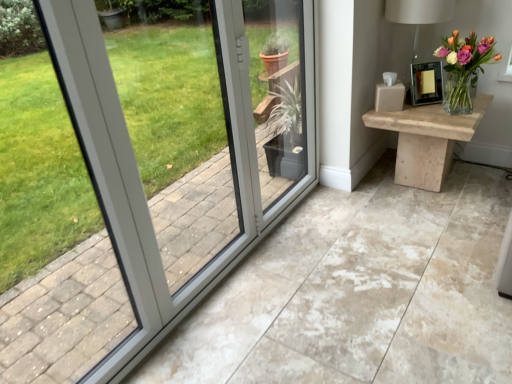
Question: Is natural wood table at right at the left side of clear glass vase at upper right?

Choices:
 (A) no
 (B) yes

Answer: (B)

Question: Could you tell me if natural wood table at right is turned towards clear glass vase at upper right?

Choices:
 (A) yes
 (B) no

Answer: (B)

Question: Does natural wood table at right lie in front of clear glass vase at upper right?

Choices:
 (A) no
 (B) yes

Answer: (A)

Question: Is natural wood table at right surrounding clear glass vase at upper right?

Choices:
 (A) yes
 (B) no

Answer: (B)

Question: Is natural wood table at right at the right side of clear glass vase at upper right?

Choices:
 (A) no
 (B) yes

Answer: (A)

Question: Is point (465, 112) positioned closer to the camera than point (420, 6)?

Choices:
 (A) farther
 (B) closer

Answer: (A)

Question: Is clear glass vase at upper right inside the boundaries of matte white table lamp at upper right, or outside?

Choices:
 (A) inside
 (B) outside

Answer: (B)

Question: From the image's perspective, relative to matte white table lamp at upper right, is clear glass vase at upper right above or below?

Choices:
 (A) above
 (B) below

Answer: (B)

Question: Considering their positions, is clear glass vase at upper right located in front of or behind matte white table lamp at upper right?

Choices:
 (A) behind
 (B) front

Answer: (B)

Question: From a real-world perspective, is natural wood table at right physically located above or below clear glass vase at upper right?

Choices:
 (A) below
 (B) above

Answer: (A)

Question: Based on their positions, is natural wood table at right located to the left or right of clear glass vase at upper right?

Choices:
 (A) left
 (B) right

Answer: (A)

Question: From the image's perspective, is natural wood table at right located above or below clear glass vase at upper right?

Choices:
 (A) above
 (B) below

Answer: (B)

Question: Looking at their shapes, would you say natural wood table at right is wider or thinner than clear glass vase at upper right?

Choices:
 (A) thin
 (B) wide

Answer: (B)

Question: In terms of size, does clear glass vase at upper right appear bigger or smaller than natural wood table at right?

Choices:
 (A) small
 (B) big

Answer: (A)

Question: From the image's perspective, is clear glass vase at upper right positioned above or below natural wood table at right?

Choices:
 (A) above
 (B) below

Answer: (A)